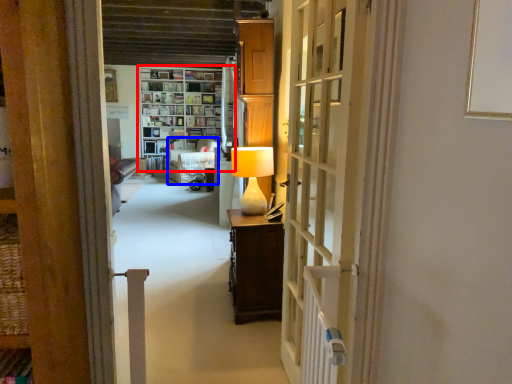
Question: Which object appears farthest to the camera in this image, shelf (highlighted by a red box) or armchair (highlighted by a blue box)?

Choices:
 (A) shelf
 (B) armchair

Answer: (A)